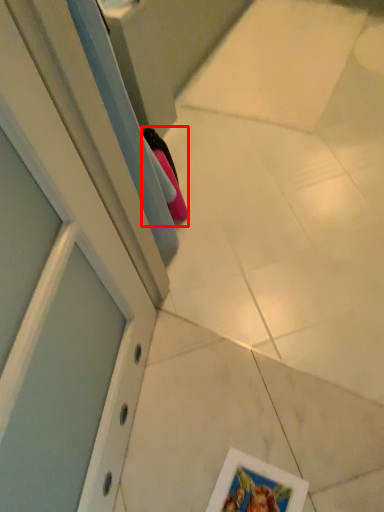
Question: From the image's perspective, what is the correct spatial relationship of shoe (annotated by the red box) in relation to picture frame?

Choices:
 (A) above
 (B) below

Answer: (A)